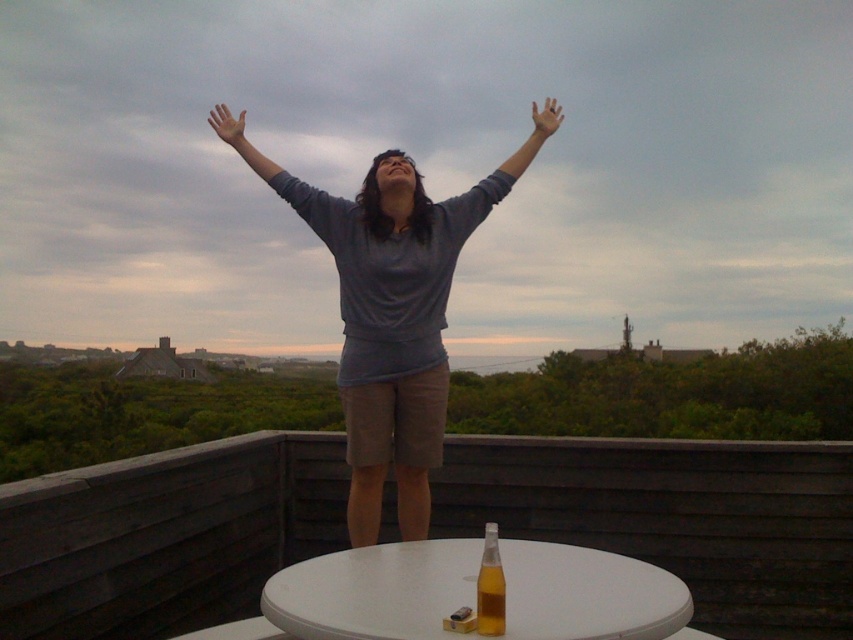
Which is more to the right, gray cotton sweater at center or matte skin hand at upper center?

matte skin hand at upper center is more to the right.

Is gray cotton sweater at center positioned before matte skin hand at upper center?

Yes.

Between point (405, 364) and point (544, 108), which one is positioned in front?

Point (405, 364) is in front.

Identify the location of gray cotton sweater at center. The width and height of the screenshot is (853, 640). (393, 317).

What do you see at coordinates (281, 177) in the screenshot?
I see `gray matte arm at upper center` at bounding box center [281, 177].

Is gray matte arm at upper center to the left of translucent glass bottle at center from the viewer's perspective?

Correct, you'll find gray matte arm at upper center to the left of translucent glass bottle at center.

I want to click on gray matte arm at upper center, so [x=281, y=177].

Identify the location of gray matte arm at upper center. Image resolution: width=853 pixels, height=640 pixels. (281, 177).

Who is lower down, translucent glass bottle at center or skinny flesh-toned hand at upper center?

translucent glass bottle at center is lower down.

Can you confirm if translucent glass bottle at center is bigger than skinny flesh-toned hand at upper center?

Actually, translucent glass bottle at center might be smaller than skinny flesh-toned hand at upper center.

Locate an element on the screen. translucent glass bottle at center is located at coordinates (490, 586).